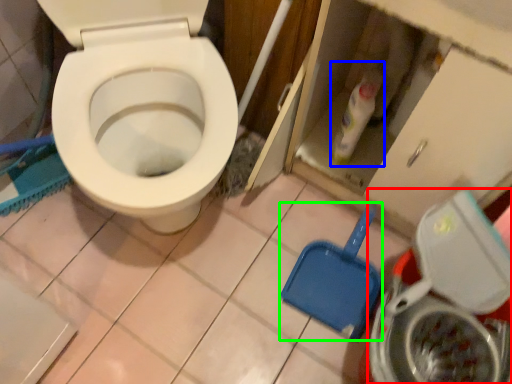
Question: Which object is the closest to the washing machine (highlighted by a red box)? Choose among these: cleaning product (highlighted by a blue box) or shovel (highlighted by a green box).

Choices:
 (A) cleaning product
 (B) shovel

Answer: (B)